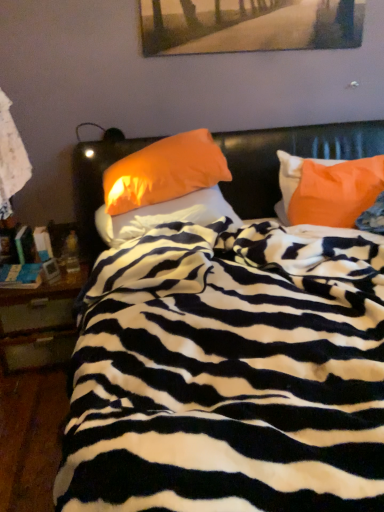
Question: Can you confirm if orange fabric pillow at center, the 2th pillow in the right-to-left sequence, is positioned to the left of orange fabric pillow at center, marked as the 3th pillow in a right-to-left arrangement?

Choices:
 (A) no
 (B) yes

Answer: (A)

Question: Is orange fabric pillow at center, the 2th pillow in the right-to-left sequence, beside orange fabric pillow at center, marked as the 3th pillow in a right-to-left arrangement?

Choices:
 (A) yes
 (B) no

Answer: (B)

Question: Is orange fabric pillow at center, the 1th pillow when ordered from left to right, at the back of orange fabric pillow at center, the 2th pillow in the right-to-left sequence?

Choices:
 (A) no
 (B) yes

Answer: (A)

Question: Is orange fabric pillow at center, the 2th pillow in the right-to-left sequence, outside of orange fabric pillow at center, marked as the 3th pillow in a right-to-left arrangement?

Choices:
 (A) no
 (B) yes

Answer: (B)

Question: Is orange fabric pillow at center, the 2th pillow in the right-to-left sequence, oriented towards orange fabric pillow at center, the 1th pillow when ordered from left to right?

Choices:
 (A) no
 (B) yes

Answer: (A)

Question: Considering their positions, is wooden nightstand at left located in front of or behind orange fabric pillow at upper right, which appears as the third pillow when viewed from the left?

Choices:
 (A) behind
 (B) front

Answer: (A)

Question: Is point (49, 322) positioned closer to the camera than point (326, 195)?

Choices:
 (A) farther
 (B) closer

Answer: (A)

Question: Is wooden nightstand at left wider or thinner than orange fabric pillow at upper right, the first pillow from the right?

Choices:
 (A) wide
 (B) thin

Answer: (A)

Question: From the image's perspective, relative to orange fabric pillow at upper right, which appears as the third pillow when viewed from the left, is wooden nightstand at left above or below?

Choices:
 (A) above
 (B) below

Answer: (B)

Question: Is orange fabric pillow at center, marked as the 3th pillow in a right-to-left arrangement, wider or thinner than zebra-patterned blanket at center?

Choices:
 (A) wide
 (B) thin

Answer: (B)

Question: Considering their positions, is orange fabric pillow at center, marked as the 3th pillow in a right-to-left arrangement, located in front of or behind zebra-patterned blanket at center?

Choices:
 (A) behind
 (B) front

Answer: (A)

Question: Is orange fabric pillow at center, the 1th pillow when ordered from left to right, taller or shorter than zebra-patterned blanket at center?

Choices:
 (A) short
 (B) tall

Answer: (A)

Question: Is point (208, 203) positioned closer to the camera than point (139, 335)?

Choices:
 (A) farther
 (B) closer

Answer: (A)

Question: From the image's perspective, is orange fabric pillow at upper right, which appears as the third pillow when viewed from the left, located above or below wooden painting at upper center?

Choices:
 (A) below
 (B) above

Answer: (A)

Question: Do you think orange fabric pillow at upper right, the first pillow from the right, is within wooden painting at upper center, or outside of it?

Choices:
 (A) outside
 (B) inside

Answer: (A)